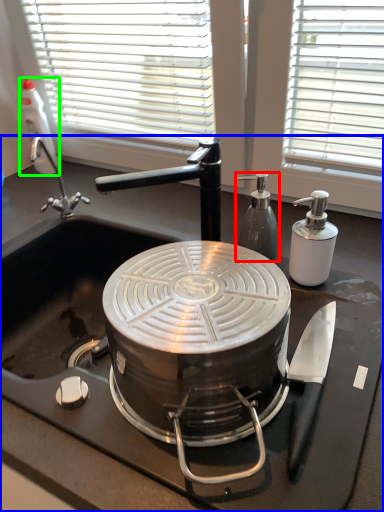
Question: Which object is positioned closest to kitchen appliance (highlighted by a red box)? Select from sink (highlighted by a blue box) and bottle (highlighted by a green box).

Choices:
 (A) sink
 (B) bottle

Answer: (A)